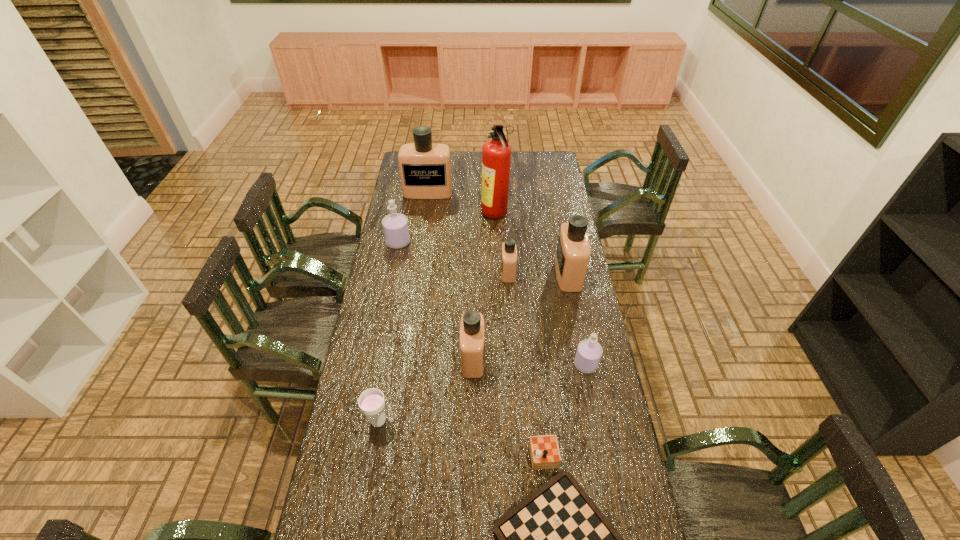
At what (x,y) coordinates should I click in order to perform the action: click on vacant space that's between the biggest beige perfume and the purple cup. Please return your answer as a coordinate pair (x, y). This screenshot has height=540, width=960. Looking at the image, I should click on (403, 307).

Locate an element on the screen. Image resolution: width=960 pixels, height=540 pixels. vacant space in between the leftmost beige perfume and the fourth perfume from right to left is located at coordinates (450, 275).

Identify which object is the eighth nearest to the red fire extinguisher. Please provide its 2D coordinates. Your answer should be formatted as a tuple, i.e. [(x, y)], where the tuple contains the x and y coordinates of a point satisfying the conditions above.

[(556, 539)]

Find the location of a particular element. The width and height of the screenshot is (960, 540). object that is the sixth closest to the third farthest object is located at coordinates (372, 403).

Where is `perfume object that ranks as the sixth closest to the shortest object`? This screenshot has height=540, width=960. perfume object that ranks as the sixth closest to the shortest object is located at coordinates (425, 168).

Identify which perfume is the fifth nearest to the bigger purple perfume. Please provide its 2D coordinates. Your answer should be formatted as a tuple, i.e. [(x, y)], where the tuple contains the x and y coordinates of a point satisfying the conditions above.

[(589, 351)]

Point out which beige perfume is positioned as the nearest to the tallest object. Please provide its 2D coordinates. Your answer should be formatted as a tuple, i.e. [(x, y)], where the tuple contains the x and y coordinates of a point satisfying the conditions above.

[(425, 168)]

Point out which beige perfume is positioned as the fourth nearest to the fire extinguisher. Please provide its 2D coordinates. Your answer should be formatted as a tuple, i.e. [(x, y)], where the tuple contains the x and y coordinates of a point satisfying the conditions above.

[(472, 331)]

This screenshot has width=960, height=540. What are the coordinates of `vacant area in the image that satisfies the following two spatial constraints: 1. on the front-facing side of the right purple perfume; 2. on the right side of the fire extinguisher` in the screenshot? It's located at (501, 364).

In order to click on free region that satisfies the following two spatial constraints: 1. on the front label of the second beige perfume from right to left; 2. on the left side of the right purple perfume in this screenshot , I will do `click(514, 364)`.